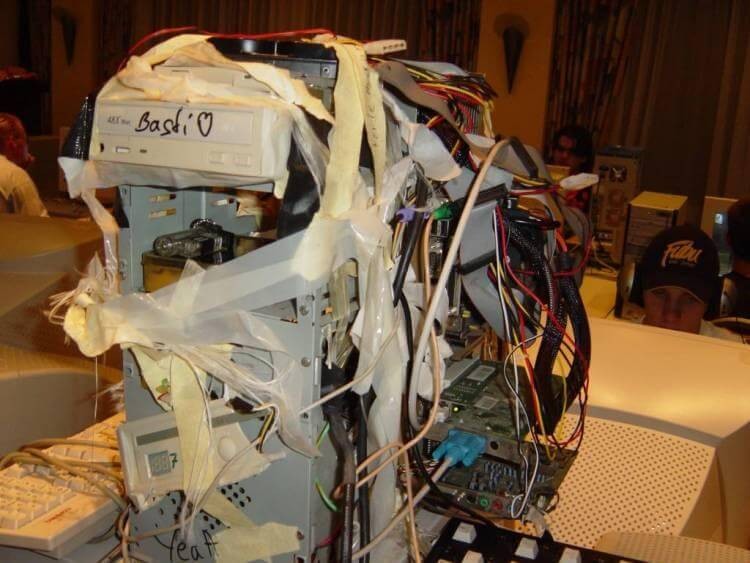
Where is `curtain`? This screenshot has width=750, height=563. curtain is located at coordinates (286, 6), (681, 67), (618, 72), (445, 25).